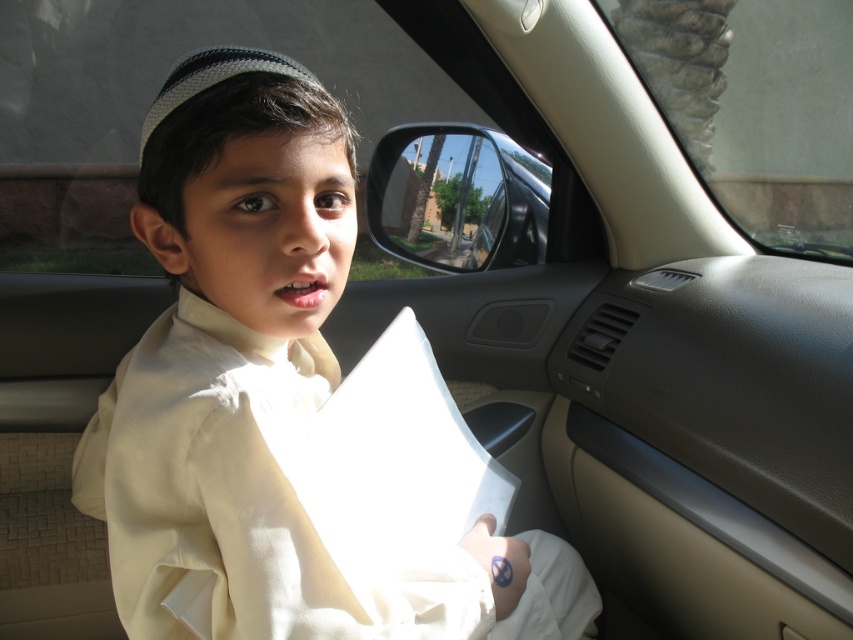
Question: Observing the image, what is the correct spatial positioning of white cotton robe at center in reference to transparent glass mirror at center?

Choices:
 (A) above
 (B) below

Answer: (B)

Question: Which object appears closest to the camera in this image?

Choices:
 (A) transparent glass mirror at center
 (B) white cotton robe at center

Answer: (B)

Question: Which object is positioned closest to the transparent glass car window at upper right?

Choices:
 (A) transparent glass mirror at center
 (B) white cotton robe at center

Answer: (A)

Question: Is white cotton robe at center behind transparent glass mirror at center?

Choices:
 (A) no
 (B) yes

Answer: (A)

Question: Does transparent glass car window at upper right appear on the left side of transparent glass mirror at center?

Choices:
 (A) no
 (B) yes

Answer: (A)

Question: Considering the real-world distances, which object is closest to the transparent glass mirror at center?

Choices:
 (A) transparent glass car window at upper right
 (B) white cotton robe at center

Answer: (B)